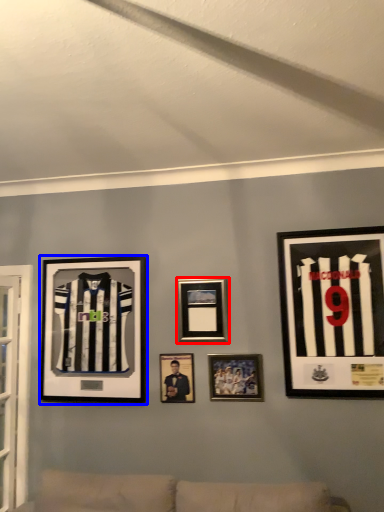
Question: Which object appears closest to the camera in this image, picture frame (highlighted by a red box) or picture frame (highlighted by a blue box)?

Choices:
 (A) picture frame
 (B) picture frame

Answer: (A)